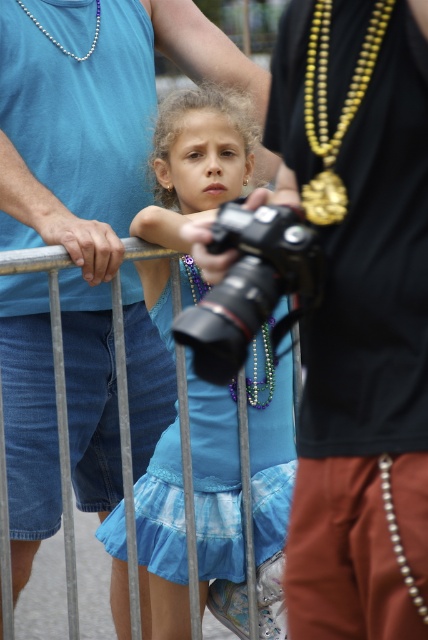
In the scene shown: You are a photographer at the event and want to capture the girl behind the barricade. The camera you are using is the black plastic camera at center. Where should you position the camera to ensure the girl is in the frame?

The black plastic camera at center is positioned at point (250, 285), so you should place the camera at those coordinates to ensure the girl is in the frame.

The young girl is wearing two necklaces. Based on the description, which necklace is taller, the gold metallic necklace at upper right or the pearl necklace at upper left?

The gold metallic necklace at upper right has a greater height compared to the pearl necklace at upper left.